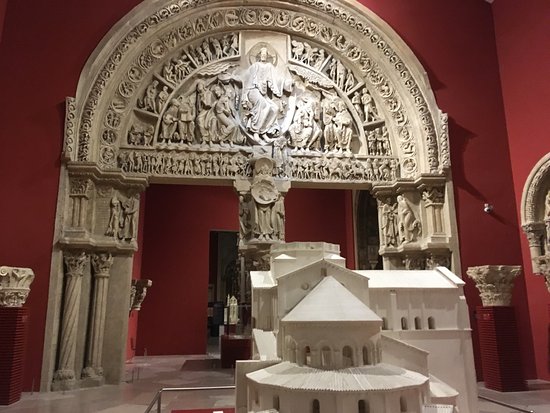
Where is `museum room`? The image size is (550, 413). museum room is located at coordinates (210, 229).